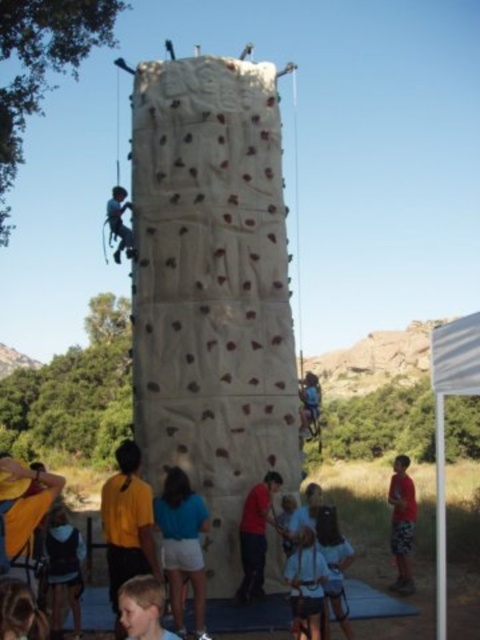
You are standing in front of the climbing area and want to locate the white textured climbing wall at center. Where should you look?

You should look at point 0.442 on the vertical axis and 0.452 on the horizontal axis to locate the white textured climbing wall at center.

You are a visitor observing the rock climbing scene. You see the white textured climbing wall at center and the matte blue shirt at lower center. Which object is taller in the image?

The white textured climbing wall at center is taller than the matte blue shirt at lower center according to the description.

You are a photographer positioned at the base of the climbing wall. You want to take a photo that includes both the white textured climbing wall at center and the red cotton shorts at lower right. Based on their positions, which object should you adjust your camera to focus on first to ensure both are in frame?

The white textured climbing wall at center is to the left of the red cotton shorts at lower right, so you should focus on the white textured climbing wall at center first to ensure both are in frame.